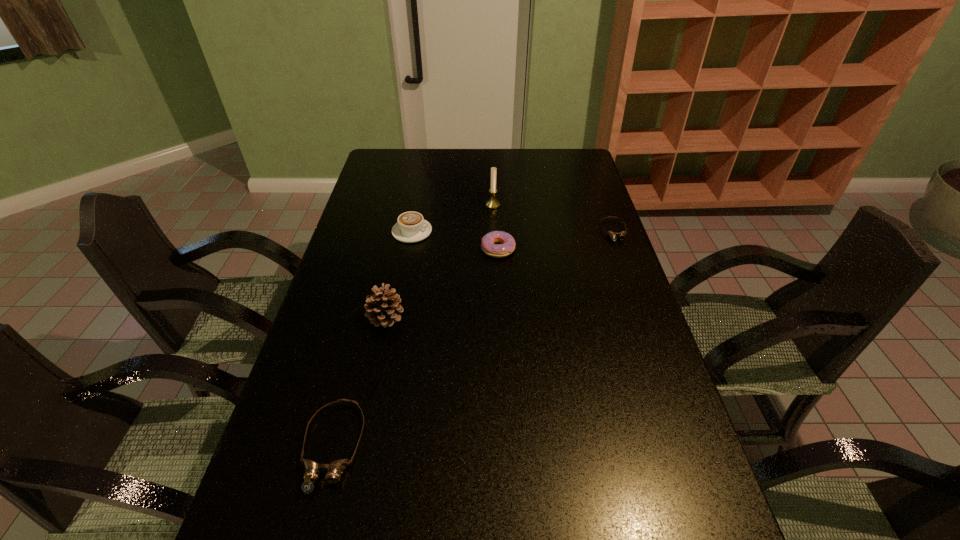
Identify the location of the second shortest object. The width and height of the screenshot is (960, 540). (312, 470).

This screenshot has width=960, height=540. I want to click on the nearer goggles, so click(312, 470).

In order to click on the farther goggles in this screenshot , I will do `click(621, 235)`.

At what (x,y) coordinates should I click in order to perform the action: click on the rightmost object. Please return your answer as a coordinate pair (x, y). Image resolution: width=960 pixels, height=540 pixels. Looking at the image, I should click on (621, 235).

Locate an element on the screen. the farthest object is located at coordinates (492, 203).

What are the coordinates of `candle holder` in the screenshot? It's located at (492, 203).

Locate an element on the screen. The image size is (960, 540). the fourth tallest object is located at coordinates tap(507, 244).

Image resolution: width=960 pixels, height=540 pixels. Identify the location of cappuccino. (411, 227).

Identify the location of the fifth farthest object. (382, 309).

The height and width of the screenshot is (540, 960). I want to click on pinecone, so click(x=382, y=309).